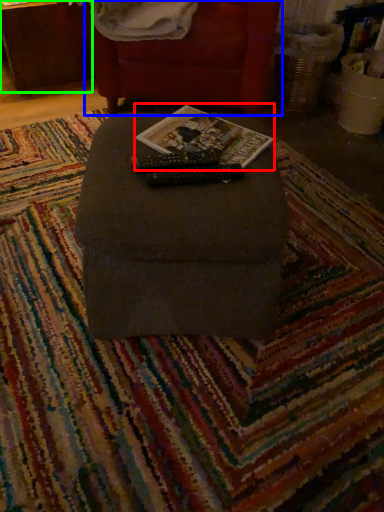
Question: Which is farther away from magazine (highlighted by a red box)? furniture (highlighted by a blue box) or table (highlighted by a green box)?

Choices:
 (A) furniture
 (B) table

Answer: (B)